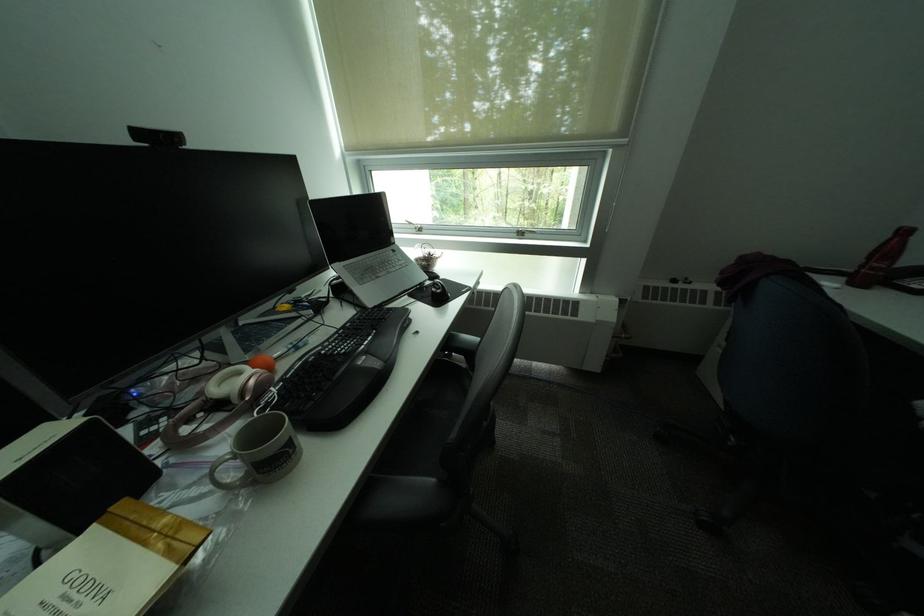
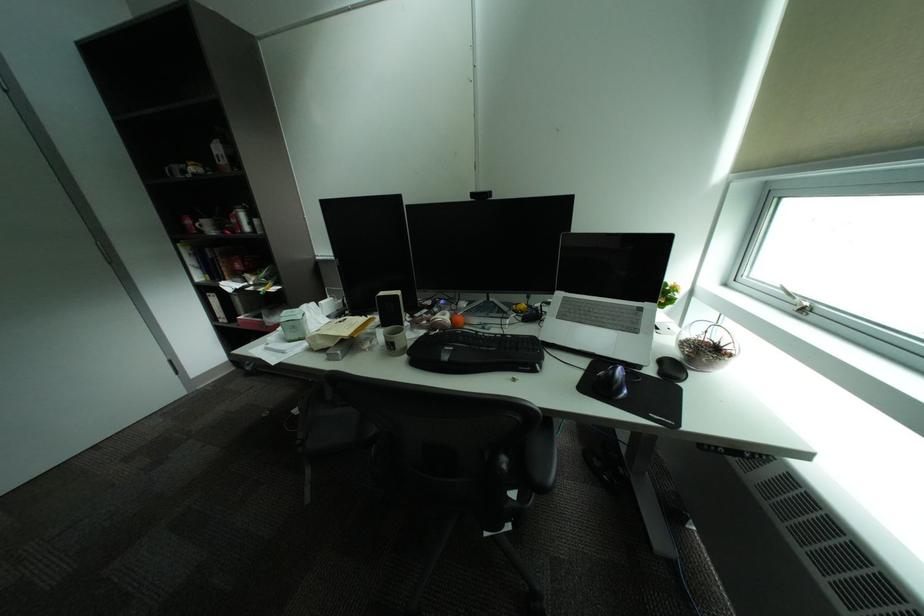
Locate, in the second image, the point that corresponds to point (301, 453) in the first image.

(403, 349)